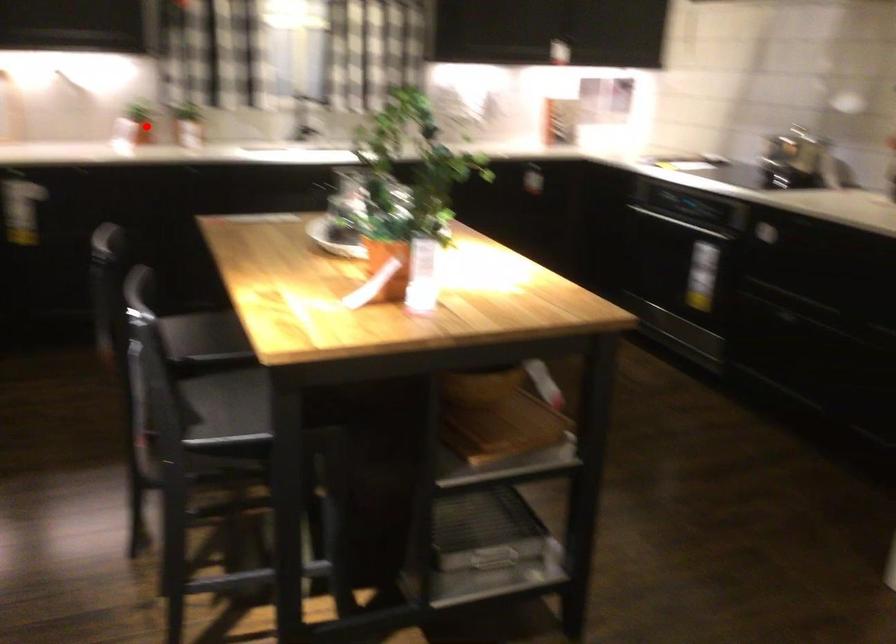
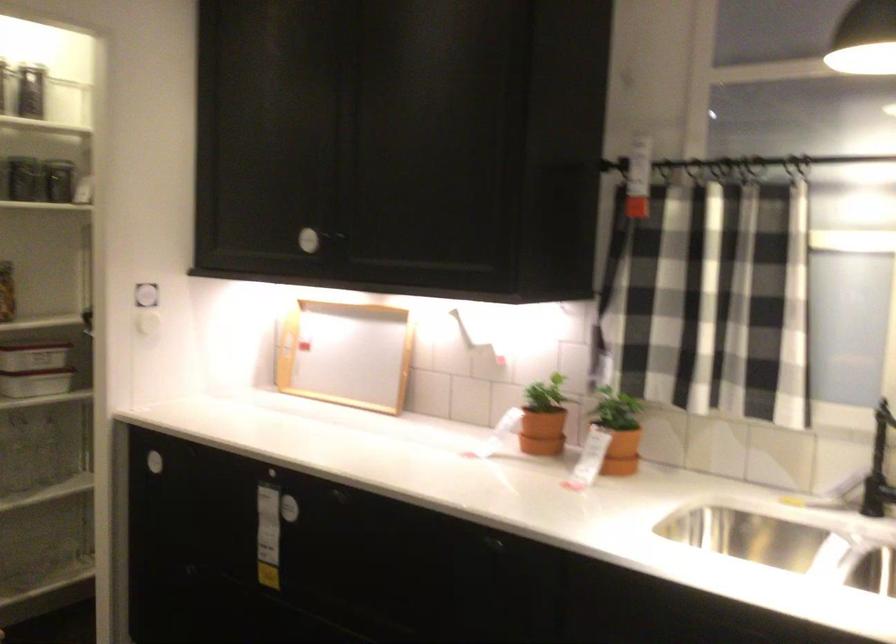
Question: I am providing you with two images of the same scene from different viewpoints. A red point is shown in image1. For the corresponding object point in image2, is it positioned nearer or farther from the camera?

Choices:
 (A) Nearer
 (B) Farther

Answer: (A)